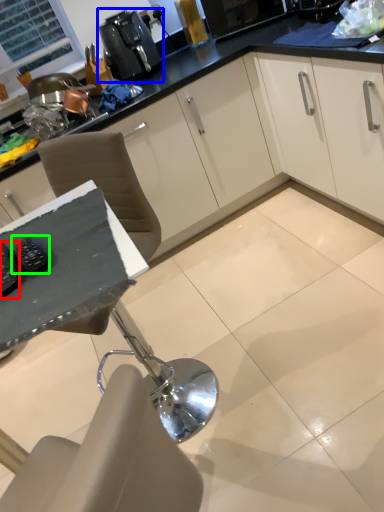
Question: Based on their relative distances, which object is farther from appliance (highlighted by a red box)? Choose from coffee machine (highlighted by a blue box) and appliance (highlighted by a green box).

Choices:
 (A) coffee machine
 (B) appliance

Answer: (A)